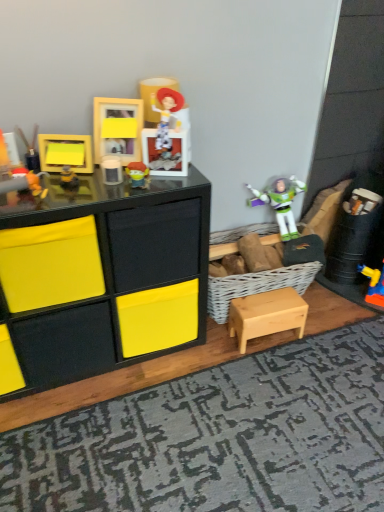
Find the location of `matte yellow frame at upper left, which appears as the fourth toy when viewed from the left`. matte yellow frame at upper left, which appears as the fourth toy when viewed from the left is located at coordinates (69, 179).

Locate an element on the screen. This screenshot has width=384, height=512. matte black frame at upper left, the first toy when ordered from left to right is located at coordinates (30, 150).

Where is `matte black chest of drawers at left`? matte black chest of drawers at left is located at coordinates (104, 277).

Image resolution: width=384 pixels, height=512 pixels. Find the location of `matte yellow frame at upper left, which ranks as the 3th toy in right-to-left order`. matte yellow frame at upper left, which ranks as the 3th toy in right-to-left order is located at coordinates (69, 179).

Is matte yellow frame at upper center, which appears as the second toy when viewed from the right, aimed at matte black frame at upper left, the 6th toy in the right-to-left sequence?

No, matte yellow frame at upper center, which appears as the second toy when viewed from the right, is not facing towards matte black frame at upper left, the 6th toy in the right-to-left sequence.

How far apart are matte yellow frame at upper center, which appears as the second toy when viewed from the right, and matte black frame at upper left, the 6th toy in the right-to-left sequence?

28.73 centimeters.

Does point (122, 142) appear closer or farther from the camera than point (38, 157)?

Point (122, 142) is farther from the camera than point (38, 157).

Is matte yellow frame at upper center, which appears as the second toy when viewed from the right, far away from matte black frame at upper left, the 6th toy in the right-to-left sequence?

No, matte yellow frame at upper center, which appears as the second toy when viewed from the right, is not far away from matte black frame at upper left, the 6th toy in the right-to-left sequence.

How many degrees apart are the facing directions of matte plastic buzz lightyear at center, which appears as the sixth toy when viewed from the left, and matte black chest of drawers at left?

4.28 degrees separate the facing orientations of matte plastic buzz lightyear at center, which appears as the sixth toy when viewed from the left, and matte black chest of drawers at left.

Is matte black chest of drawers at left a part of matte plastic buzz lightyear at center, which appears as the sixth toy when viewed from the left?

No, matte black chest of drawers at left is not a part of matte plastic buzz lightyear at center, which appears as the sixth toy when viewed from the left.

From a real-world perspective, relative to matte black chest of drawers at left, is matte plastic buzz lightyear at center, which appears as the sixth toy when viewed from the left, vertically above or below?

From a real-world perspective, matte plastic buzz lightyear at center, which appears as the sixth toy when viewed from the left, is physically above matte black chest of drawers at left.

Can you confirm if matte plastic buzz lightyear at center, arranged as the first toy when viewed from the right, is shorter than matte black chest of drawers at left?

Correct, matte plastic buzz lightyear at center, arranged as the first toy when viewed from the right, is not as tall as matte black chest of drawers at left.

Could matte black chest of drawers at left be considered to be inside light wood table at lower right?

No, matte black chest of drawers at left is not surrounded by light wood table at lower right.

Does light wood table at lower right appear on the right side of matte black chest of drawers at left?

Yes, light wood table at lower right is to the right of matte black chest of drawers at left.

Is light wood table at lower right shorter than matte black chest of drawers at left?

Correct, light wood table at lower right is not as tall as matte black chest of drawers at left.

Are matte black chest of drawers at left and matte yellow frame at upper center, which appears as the second toy when viewed from the right, beside each other?

→ No, matte black chest of drawers at left is not touching matte yellow frame at upper center, which appears as the second toy when viewed from the right.

Identify the location of chest of drawers in front of the matte yellow frame at upper center, which is counted as the fifth toy, starting from the left. This screenshot has height=512, width=384. (104, 277).

From a real-world perspective, is matte black chest of drawers at left below matte yellow frame at upper center, which is counted as the fifth toy, starting from the left?

Yes, from a real-world perspective, matte black chest of drawers at left is beneath matte yellow frame at upper center, which is counted as the fifth toy, starting from the left.

From a real-world perspective, which object rests below the other?

In real-world perspective, light wood table at lower right is lower.

How different are the orientations of matte plastic buzz lightyear at center, arranged as the first toy when viewed from the right, and light wood table at lower right in degrees?

There is a 4.09-degree angle between the facing directions of matte plastic buzz lightyear at center, arranged as the first toy when viewed from the right, and light wood table at lower right.

From the image's perspective, is matte plastic buzz lightyear at center, which appears as the sixth toy when viewed from the left, over light wood table at lower right?

Yes, from the image's perspective, matte plastic buzz lightyear at center, which appears as the sixth toy when viewed from the left, is on top of light wood table at lower right.

Is matte black toy at left, marked as the 2th toy in a left-to-right arrangement, positioned far away from textured gray rug at lower center?

Yes.

Who is shorter, matte black toy at left, marked as the 2th toy in a left-to-right arrangement, or textured gray rug at lower center?

Standing shorter between the two is textured gray rug at lower center.

Can you confirm if matte black toy at left, placed as the fifth toy when sorted from right to left, is smaller than textured gray rug at lower center?

Yes, matte black toy at left, placed as the fifth toy when sorted from right to left, is smaller than textured gray rug at lower center.

The width and height of the screenshot is (384, 512). Find the location of `the 2nd toy directly above the matte yellow frame at upper left, which appears as the fourth toy when viewed from the left (from a real-world perspective)`. the 2nd toy directly above the matte yellow frame at upper left, which appears as the fourth toy when viewed from the left (from a real-world perspective) is located at coordinates (137, 174).

Is matte yellow frame at upper left, which appears as the fourth toy when viewed from the left, inside or outside of matte plastic buzz lightyear at center, which appears as the sixth toy when viewed from the left?

matte yellow frame at upper left, which appears as the fourth toy when viewed from the left, is located beyond the bounds of matte plastic buzz lightyear at center, which appears as the sixth toy when viewed from the left.

From the image's perspective, which is above, matte yellow frame at upper left, which ranks as the 3th toy in right-to-left order, or matte plastic buzz lightyear at center, which appears as the sixth toy when viewed from the left?

From the image's view, matte plastic buzz lightyear at center, which appears as the sixth toy when viewed from the left, is above.

Between matte yellow frame at upper left, which ranks as the 3th toy in right-to-left order, and matte plastic buzz lightyear at center, which appears as the sixth toy when viewed from the left, which one is positioned in front?

Positioned in front is matte plastic buzz lightyear at center, which appears as the sixth toy when viewed from the left.

The width and height of the screenshot is (384, 512). Find the location of `toy above the matte black frame at upper left, the first toy when ordered from left to right (from the image's perspective)`. toy above the matte black frame at upper left, the first toy when ordered from left to right (from the image's perspective) is located at coordinates point(117,129).

At what (x,y) coordinates should I click in order to perform the action: click on the chest of drawers that appears below the matte plastic buzz lightyear at center, arranged as the first toy when viewed from the right (from a real-world perspective). Please return your answer as a coordinate pair (x, y). The height and width of the screenshot is (512, 384). Looking at the image, I should click on (104, 277).

Based on their spatial positions, is matte black frame at upper left, the first toy when ordered from left to right, or yellow matte frame at upper left, the 3th toy when ordered from left to right, further from light wood table at lower right?

The object further to light wood table at lower right is matte black frame at upper left, the first toy when ordered from left to right.

Considering their positions, is matte yellow frame at upper center, which is counted as the fifth toy, starting from the left, positioned further to yellow matte frame at upper left, the 3th toy when ordered from left to right, than matte plastic buzz lightyear at center, which appears as the sixth toy when viewed from the left?

matte plastic buzz lightyear at center, which appears as the sixth toy when viewed from the left, is positioned further to the anchor yellow matte frame at upper left, the 3th toy when ordered from left to right.

Based on the photo, considering their positions, is matte yellow frame at upper left, which ranks as the 3th toy in right-to-left order, positioned further to textured gray rug at lower center than matte plastic buzz lightyear at center, arranged as the first toy when viewed from the right?

The object further to textured gray rug at lower center is matte yellow frame at upper left, which ranks as the 3th toy in right-to-left order.

From the image, which object appears to be farther from matte plastic buzz lightyear at center, which appears as the sixth toy when viewed from the left, light wood table at lower right or matte black chest of drawers at left?

light wood table at lower right is further to matte plastic buzz lightyear at center, which appears as the sixth toy when viewed from the left.

When comparing their distances from matte black frame at upper left, the 6th toy in the right-to-left sequence, does yellow matte frame at upper left, the fourth toy when ordered from right to left, or textured gray rug at lower center seem closer?

yellow matte frame at upper left, the fourth toy when ordered from right to left, is closer to matte black frame at upper left, the 6th toy in the right-to-left sequence.

From the image, which object appears to be nearer to matte black frame at upper left, the first toy when ordered from left to right, matte black toy at left, marked as the 2th toy in a left-to-right arrangement, or yellow matte frame at upper left, the 3th toy when ordered from left to right?

yellow matte frame at upper left, the 3th toy when ordered from left to right, lies closer to matte black frame at upper left, the first toy when ordered from left to right, than the other object.

From the picture: When comparing their distances from matte yellow frame at upper center, which is counted as the fifth toy, starting from the left, does yellow matte frame at upper left, the 3th toy when ordered from left to right, or matte black toy at left, placed as the fifth toy when sorted from right to left, seem further?

matte black toy at left, placed as the fifth toy when sorted from right to left.

Considering their positions, is matte plastic buzz lightyear at center, which appears as the sixth toy when viewed from the left, positioned closer to matte yellow frame at upper center, which appears as the second toy when viewed from the right, than matte black toy at left, placed as the fifth toy when sorted from right to left?

matte plastic buzz lightyear at center, which appears as the sixth toy when viewed from the left, lies closer to matte yellow frame at upper center, which appears as the second toy when viewed from the right, than the other object.

This screenshot has height=512, width=384. I want to click on toy between matte black frame at upper left, the 6th toy in the right-to-left sequence, and yellow matte frame at upper left, the 3th toy when ordered from left to right, from left to right, so click(x=32, y=181).

Find the location of a particular element. toy located between yellow matte frame at upper left, the fourth toy when ordered from right to left, and matte yellow frame at upper center, which appears as the second toy when viewed from the right, in the left-right direction is located at coordinates (69, 179).

You are a GUI agent. You are given a task and a screenshot of the screen. Output one action in this format:
    pyautogui.click(x=<x>, y=<y>)
    Task: Click on the toy located between matte black toy at left, placed as the fifth toy when sorted from right to left, and matte yellow frame at upper left, which ranks as the 3th toy in right-to-left order, in the left-right direction
    
    Given the screenshot: What is the action you would take?
    pyautogui.click(x=65, y=153)

Find the location of a particular element. This screenshot has width=384, height=512. toy between matte yellow frame at upper left, which ranks as the 3th toy in right-to-left order, and matte black chest of drawers at left vertically is located at coordinates (32, 181).